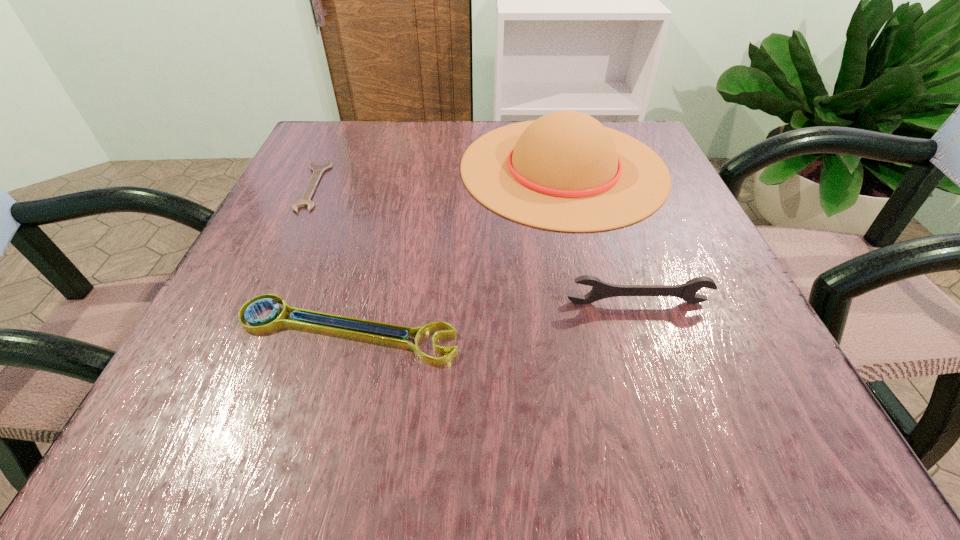
This screenshot has height=540, width=960. I want to click on the tallest object, so click(566, 172).

Locate an element on the screen. The height and width of the screenshot is (540, 960). the rightmost wrench is located at coordinates (600, 290).

You are a GUI agent. You are given a task and a screenshot of the screen. Output one action in this format:
    pyautogui.click(x=<x>, y=<y>)
    Task: Click on the tallest wrench
    
    Given the screenshot: What is the action you would take?
    pyautogui.click(x=600, y=290)

What are the coordinates of `the second shortest object` in the screenshot? It's located at (275, 320).

In order to click on the farthest wrench in this screenshot , I will do `click(305, 201)`.

Where is `the shortest object`? the shortest object is located at coordinates (305, 201).

You are a GUI agent. You are given a task and a screenshot of the screen. Output one action in this format:
    pyautogui.click(x=<x>, y=<y>)
    Task: Click on the vacant region located on the front of the tallest object
    
    Given the screenshot: What is the action you would take?
    pyautogui.click(x=593, y=288)

This screenshot has width=960, height=540. Find the location of `vacant space situated 0.160m on the open ends of the rightmost wrench`. vacant space situated 0.160m on the open ends of the rightmost wrench is located at coordinates (671, 406).

Locate an element on the screen. The width and height of the screenshot is (960, 540). vacant space located on the right of the second tallest wrench is located at coordinates (495, 330).

Identify the location of free space located 0.110m on the right of the shortest object. Image resolution: width=960 pixels, height=540 pixels. (381, 186).